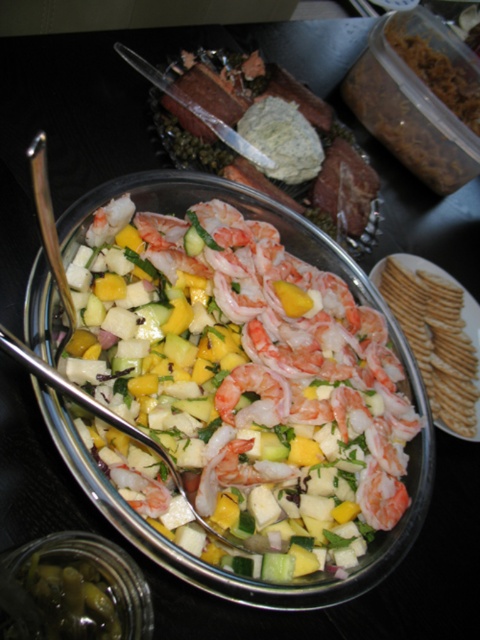
Which is below, shiny pink shrimp at center or pinkish matte shrimp at center?

Positioned lower is pinkish matte shrimp at center.

Can you confirm if shiny pink shrimp at center is shorter than pinkish matte shrimp at center?

No.

I want to click on shiny pink shrimp at center, so click(240, 364).

Can you confirm if pink glossy shrimp at center is positioned above pinkish matte shrimp at center?

Correct, pink glossy shrimp at center is located above pinkish matte shrimp at center.

Does pink glossy shrimp at center have a greater height compared to pinkish matte shrimp at center?

Correct, pink glossy shrimp at center is much taller as pinkish matte shrimp at center.

What do you see at coordinates (255, 392) in the screenshot? I see `pink glossy shrimp at center` at bounding box center [255, 392].

Locate an element on the screen. The height and width of the screenshot is (640, 480). pink glossy shrimp at center is located at coordinates (255, 392).

Is point (276, 540) closer to camera compared to point (225, 384)?

That is True.

Between shiny pink shrimp at center and pink glossy shrimp at center, which one is positioned lower?

pink glossy shrimp at center is lower down.

Is point (188, 394) farther from viewer compared to point (269, 422)?

Yes, it is.

Locate an element on the screen. This screenshot has width=480, height=640. shiny pink shrimp at center is located at coordinates (240, 364).